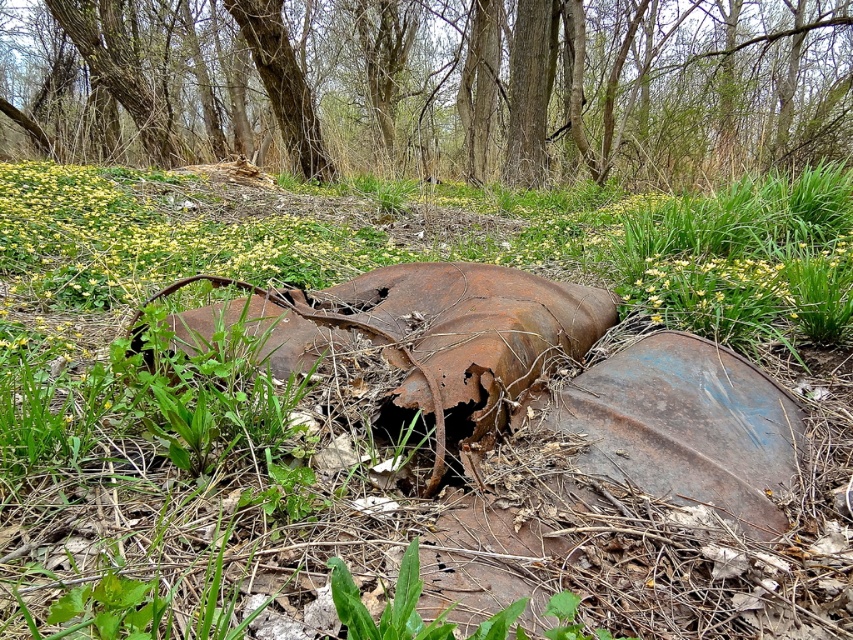
You are a hiker navigating through the forest and want to reach a specific point in the distance. You notice two points marked in the image, point 1 at coordinates point (x=368, y=552) and point 2 at coordinates point (x=709, y=17). Which point is closer to your current position?

Point (x=368, y=552) is closer to the viewer than point (x=709, y=17), so you are closer to point 1.